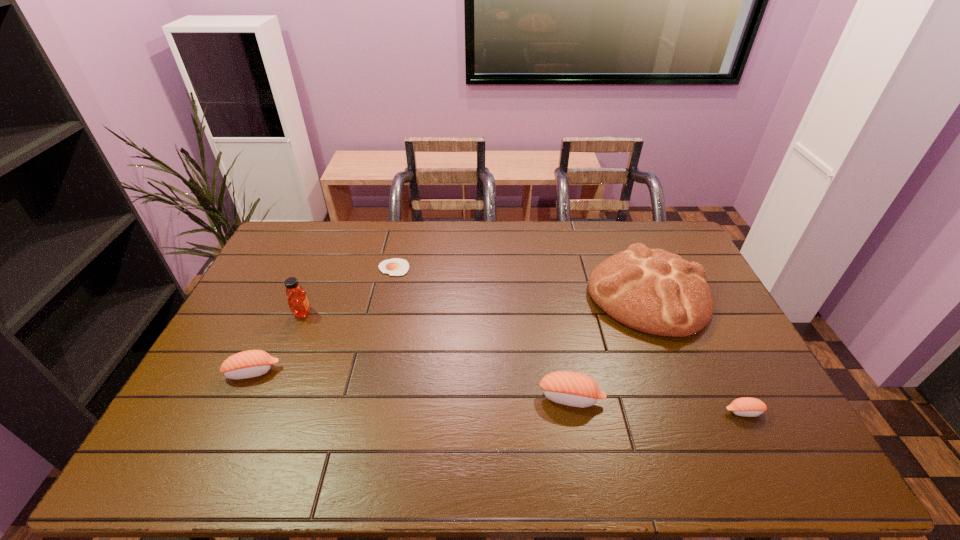
Identify the location of free space between the bread and the shortest object. The height and width of the screenshot is (540, 960). (520, 281).

The width and height of the screenshot is (960, 540). I want to click on empty location between the second sushi from right to left and the bread, so click(610, 346).

You are a GUI agent. You are given a task and a screenshot of the screen. Output one action in this format:
    pyautogui.click(x=<x>, y=<y>)
    Task: Click on the vacant space in between the bread and the shortest sushi
    This screenshot has width=960, height=540.
    Given the screenshot: What is the action you would take?
    pyautogui.click(x=696, y=353)

You are a GUI agent. You are given a task and a screenshot of the screen. Output one action in this format:
    pyautogui.click(x=<x>, y=<y>)
    Task: Click on the empty space that is in between the leftmost sushi and the second sushi from left to right
    Image resolution: width=960 pixels, height=540 pixels.
    Given the screenshot: What is the action you would take?
    pyautogui.click(x=412, y=385)

This screenshot has height=540, width=960. I want to click on vacant space in between the leftmost sushi and the second sushi from left to right, so click(x=412, y=385).

The width and height of the screenshot is (960, 540). I want to click on vacant point located between the bread and the third shortest object, so click(x=450, y=333).

Locate an element on the screen. The width and height of the screenshot is (960, 540). vacant area that lies between the farthest sushi and the honey is located at coordinates (277, 342).

In order to click on free spot between the bread and the fourth object from right to left in this screenshot , I will do `click(520, 281)`.

Where is `object that is the second closest to the rightmost sushi`? The image size is (960, 540). object that is the second closest to the rightmost sushi is located at coordinates (575, 389).

Locate an element on the screen. This screenshot has height=540, width=960. the closest object to the bread is located at coordinates (575, 389).